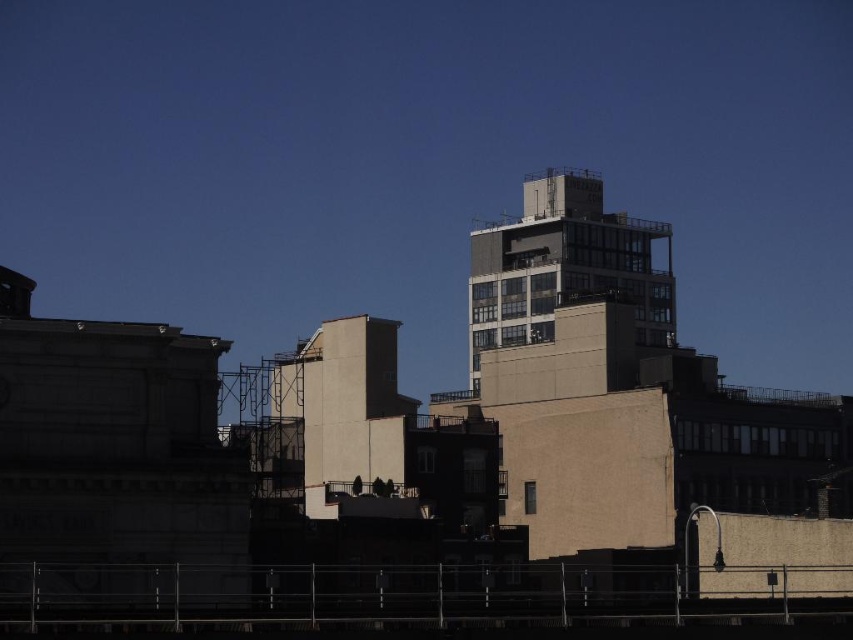
Between concrete building at center and smooth beige wall at center, which one has more height?

Standing taller between the two is concrete building at center.

Is concrete building at center closer to the viewer compared to smooth beige wall at center?

No, concrete building at center is further to the viewer.

Does point (590, 298) lie behind point (384, 458)?

Yes, point (590, 298) is behind point (384, 458).

Find the location of `concrete building at center`. concrete building at center is located at coordinates (566, 266).